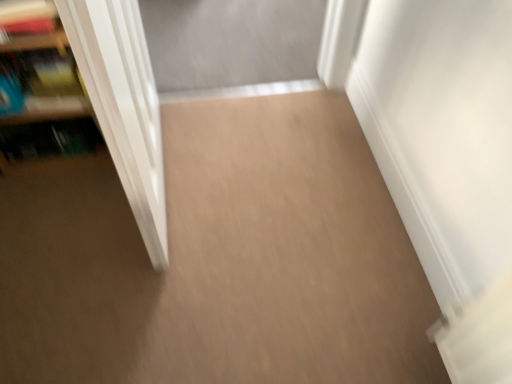
Question: Does white glossy door at left have a lesser width compared to wooden bookshelf at left?

Choices:
 (A) yes
 (B) no

Answer: (B)

Question: Does white glossy door at left appear on the left side of wooden bookshelf at left?

Choices:
 (A) yes
 (B) no

Answer: (B)

Question: From the image's perspective, would you say white glossy door at left is positioned over wooden bookshelf at left?

Choices:
 (A) yes
 (B) no

Answer: (B)

Question: Does white glossy door at left appear on the right side of wooden bookshelf at left?

Choices:
 (A) no
 (B) yes

Answer: (B)

Question: Is white glossy door at left facing towards wooden bookshelf at left?

Choices:
 (A) no
 (B) yes

Answer: (A)

Question: Considering the relative sizes of white glossy door at left and wooden bookshelf at left in the image provided, is white glossy door at left wider than wooden bookshelf at left?

Choices:
 (A) no
 (B) yes

Answer: (B)

Question: Is wooden bookshelf at left beside white glossy door at left?

Choices:
 (A) no
 (B) yes

Answer: (A)

Question: Would you say wooden bookshelf at left is outside white glossy door at left?

Choices:
 (A) no
 (B) yes

Answer: (B)

Question: Is wooden bookshelf at left far away from white glossy door at left?

Choices:
 (A) no
 (B) yes

Answer: (A)

Question: Could you tell me if wooden bookshelf at left is facing white glossy door at left?

Choices:
 (A) no
 (B) yes

Answer: (A)

Question: Is white glossy door at left inside wooden bookshelf at left?

Choices:
 (A) no
 (B) yes

Answer: (A)

Question: From a real-world perspective, is wooden bookshelf at left on white glossy door at left?

Choices:
 (A) yes
 (B) no

Answer: (B)

Question: Is white glossy door at left wider or thinner than wooden bookshelf at left?

Choices:
 (A) thin
 (B) wide

Answer: (B)